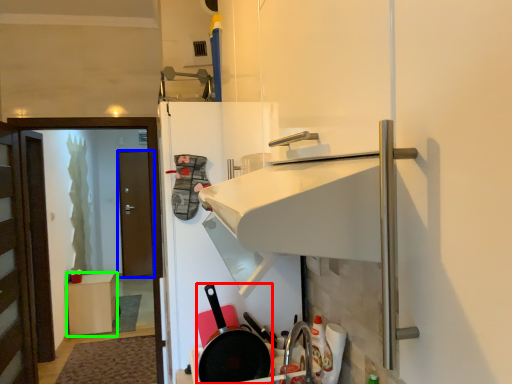
Question: Which object is the closest to the frying pan (highlighted by a red box)? Choose among these: door (highlighted by a blue box) or furniture (highlighted by a green box).

Choices:
 (A) door
 (B) furniture

Answer: (B)